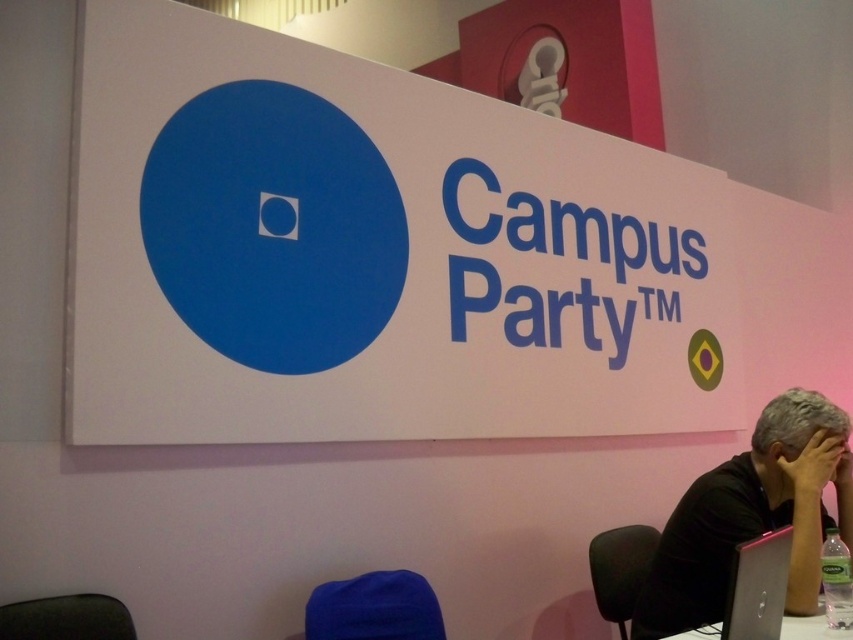
Question: Which point is farther from the camera taking this photo?

Choices:
 (A) 480,230
 (B) 787,408
 (C) 814,433

Answer: (A)

Question: Is white matte sign at upper center positioned at the back of gray matte head at lower right?

Choices:
 (A) yes
 (B) no

Answer: (B)

Question: Estimate the real-world distances between objects in this image. Which object is closer to the black matte shirt at lower right?

Choices:
 (A) white plastic table at lower right
 (B) white matte sign at upper center

Answer: (A)

Question: Is black matte shirt at lower right further to camera compared to white plastic table at lower right?

Choices:
 (A) no
 (B) yes

Answer: (B)

Question: Is black matte shirt at lower right to the right of silver metallic laptop at lower right from the viewer's perspective?

Choices:
 (A) yes
 (B) no

Answer: (A)

Question: Among these points, which one is farthest from the camera?

Choices:
 (A) (801, 464)
 (B) (735, 586)
 (C) (666, 586)

Answer: (C)